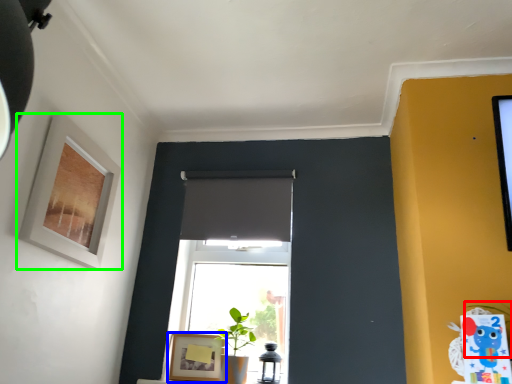
Question: Estimate the real-world distances between objects in this image. Which object is farther from plant (highlighted by a red box), picture frame (highlighted by a blue box) or picture frame (highlighted by a green box)?

Choices:
 (A) picture frame
 (B) picture frame

Answer: (B)